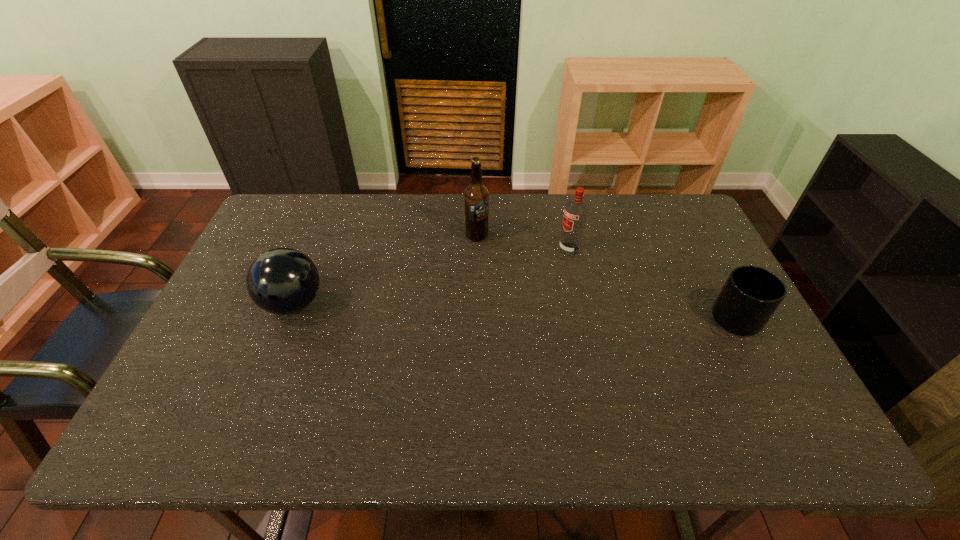
You are a GUI agent. You are given a task and a screenshot of the screen. Output one action in this format:
    pyautogui.click(x=<x>, y=<y>)
    Task: Click on the free space on the desktop that is between the leftmost object and the shortest object and is positioned on the front label of the vodka
    The image size is (960, 540).
    Given the screenshot: What is the action you would take?
    pyautogui.click(x=456, y=309)

The image size is (960, 540). In order to click on free space on the desktop that is between the third tallest object and the mug and is positioned on the label of the third object from right to left in this screenshot , I will do `click(527, 312)`.